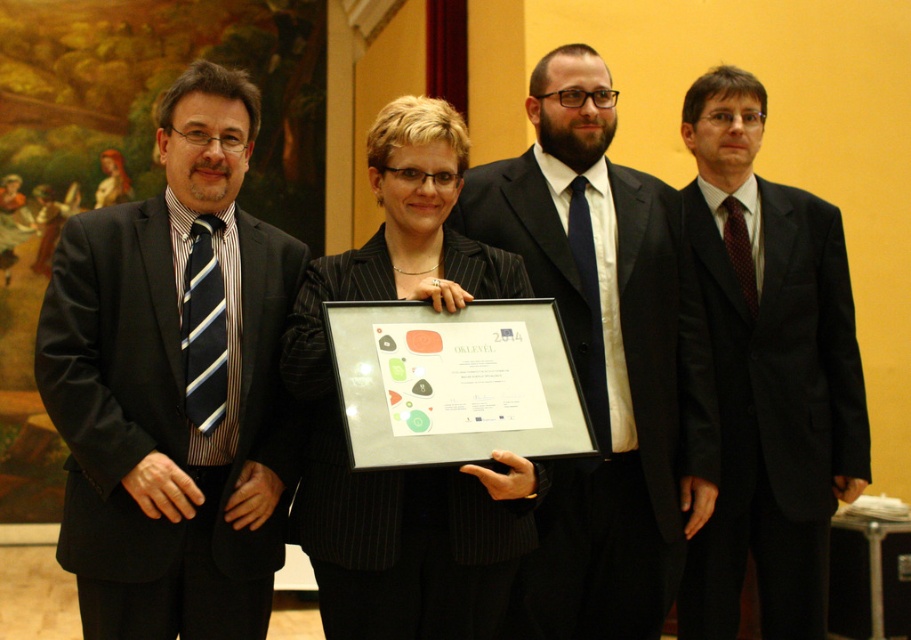
Question: From the image, what is the correct spatial relationship of matte black suit at center in relation to black satin suit at right?

Choices:
 (A) below
 (B) above

Answer: (B)

Question: Among these objects, which one is nearest to the camera?

Choices:
 (A) black satin suit at right
 (B) black pinstripe suit at center

Answer: (B)

Question: Among these objects, which one is farthest from the camera?

Choices:
 (A) black satin suit at right
 (B) matte black suit at center

Answer: (A)

Question: Is matte black suit at center thinner than black satin suit at right?

Choices:
 (A) no
 (B) yes

Answer: (A)

Question: Which object appears farthest from the camera in this image?

Choices:
 (A) black satin suit at right
 (B) matte black suit at left
 (C) black pinstripe suit at center

Answer: (A)

Question: Can you confirm if matte black suit at left is positioned below black pinstripe suit at center?

Choices:
 (A) no
 (B) yes

Answer: (A)